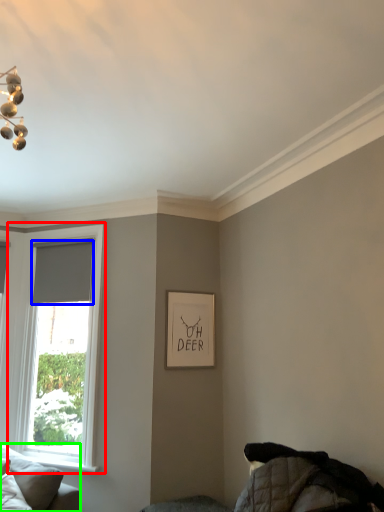
Question: Considering the real-world distances, which object is farthest from window (highlighted by a red box)? curtain (highlighted by a blue box) or studio couch (highlighted by a green box)?

Choices:
 (A) curtain
 (B) studio couch

Answer: (B)